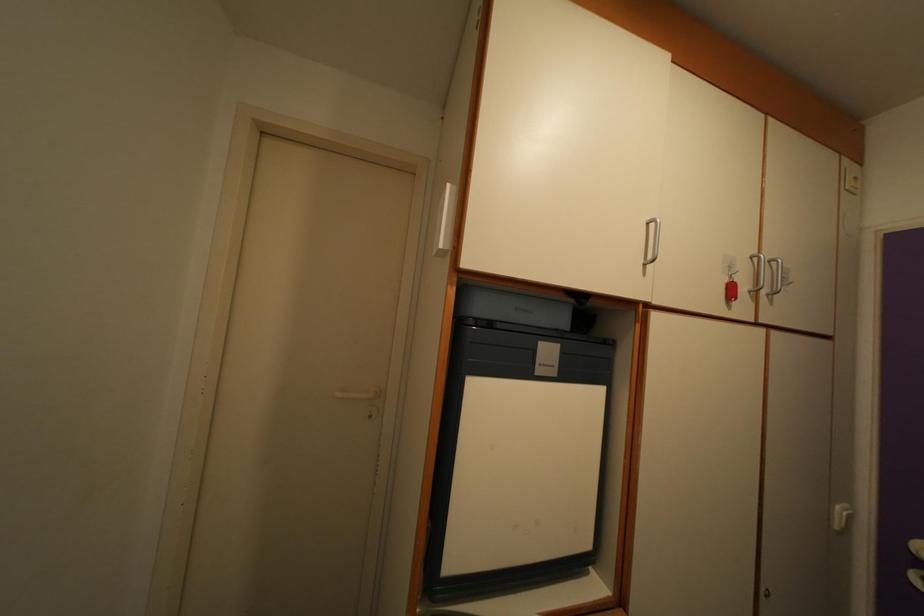
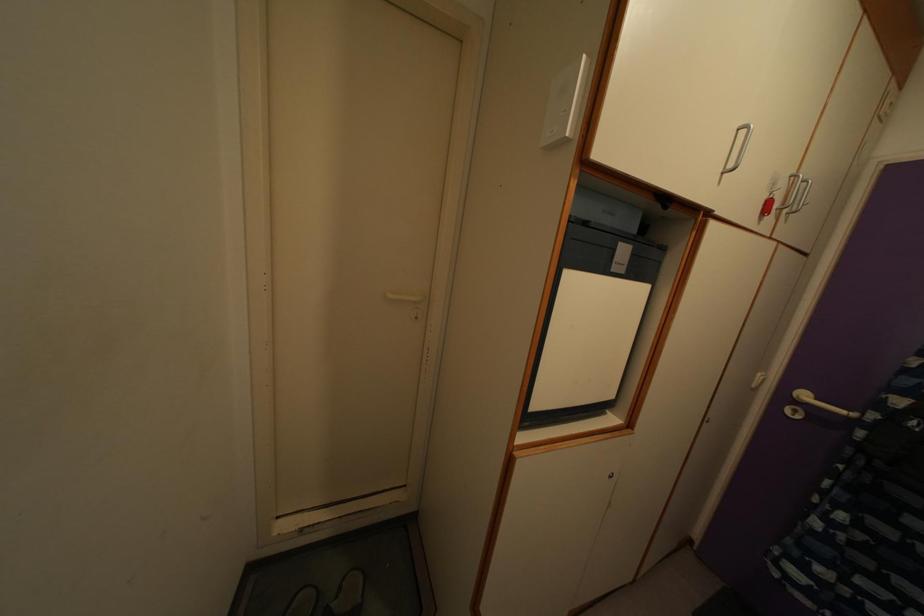
Question: Based on the continuous images, in which direction is the camera rotating? Reply with the corresponding letter.

Choices:
 (A) Left
 (B) Right
 (C) Up
 (D) Down

Answer: (D)